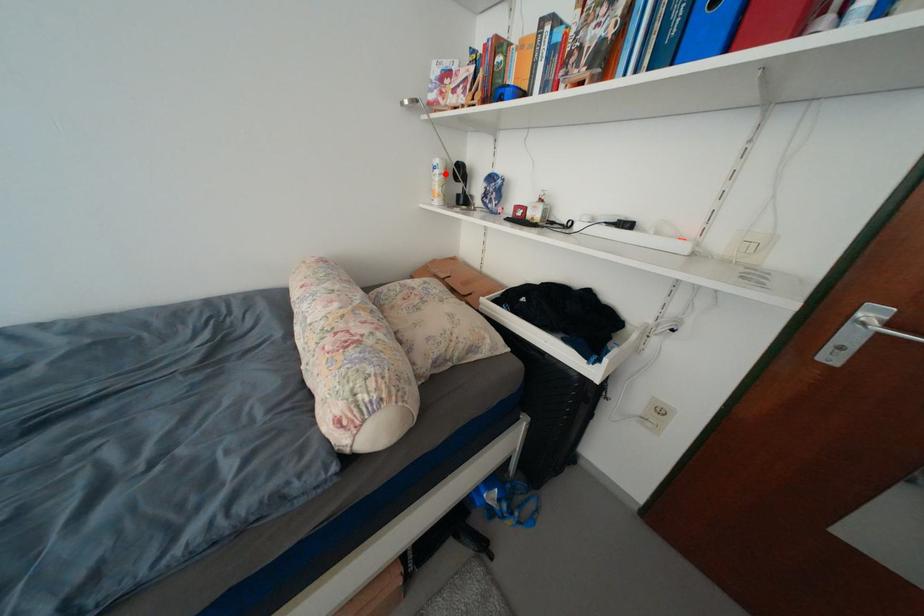
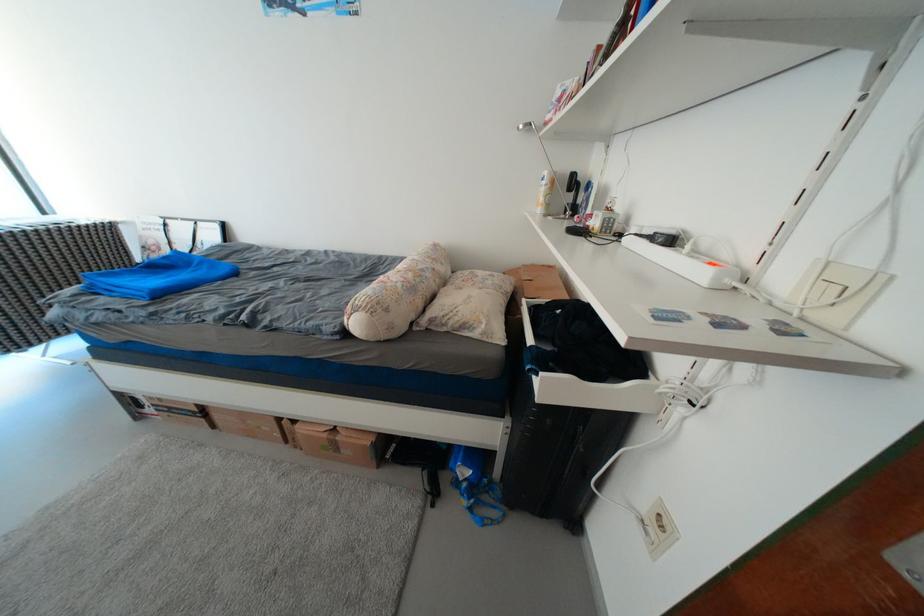
Where in the second image is the point corresponding to the highlighted location from the first image?

(553, 185)